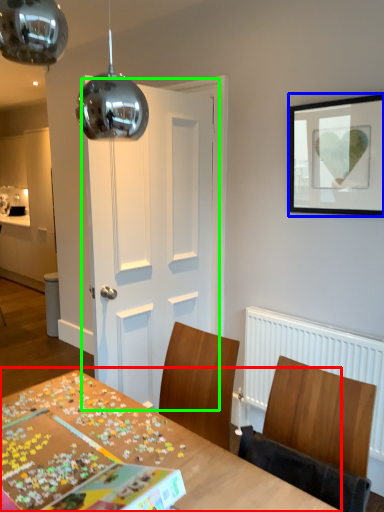
Question: Which object is positioned closest to table (highlighted by a red box)? Select from picture frame (highlighted by a blue box) and door (highlighted by a green box).

Choices:
 (A) picture frame
 (B) door

Answer: (B)